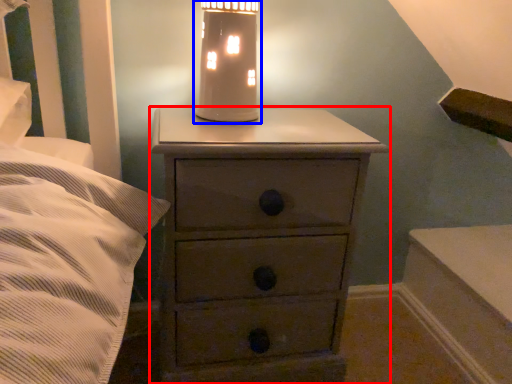
Question: Which object appears closest to the camera in this image, chest of drawers (highlighted by a red box) or oil lamp (highlighted by a blue box)?

Choices:
 (A) chest of drawers
 (B) oil lamp

Answer: (A)